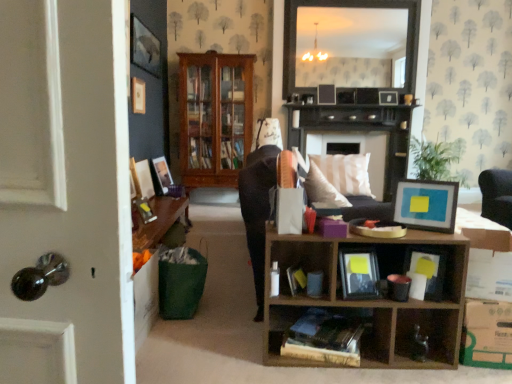
The width and height of the screenshot is (512, 384). I want to click on hardcover book at center, positioned as the first book in left-to-right order, so click(327, 330).

Where is `wooden cabinet at center`? The height and width of the screenshot is (384, 512). wooden cabinet at center is located at coordinates (215, 117).

At what (x,y) coordinates should I click in order to perform the action: click on matte black photo frame at center, the second book positioned from the left. Please return your answer as a coordinate pair (x, y). Looking at the image, I should click on point(359,273).

What do you see at coordinates (144, 179) in the screenshot? This screenshot has width=512, height=384. I see `wooden picture frame at left, placed as the 5th picture frame when sorted from back to front` at bounding box center [144, 179].

This screenshot has width=512, height=384. What are the coordinates of `hardcover book at center, placed as the third book when sorted from right to left` in the screenshot? It's located at (327, 330).

Consider the image. Between white cardboard box at lower right and matte black book at lower right, the first book in the right-to-left sequence, which one is positioned in front?

white cardboard box at lower right is closer to the camera.

Considering the positions of objects white cardboard box at lower right and matte black book at lower right, the third book when ordered from left to right, in the image provided, who is more to the right, white cardboard box at lower right or matte black book at lower right, the third book when ordered from left to right,?

white cardboard box at lower right is more to the right.

In terms of height, does white cardboard box at lower right look taller or shorter compared to matte black book at lower right, the third book when ordered from left to right?

white cardboard box at lower right is shorter than matte black book at lower right, the third book when ordered from left to right.

Is matte black picture frame at upper center, the 6th picture frame when ordered from left to right, situated inside matte black book at lower right, the first book in the right-to-left sequence, or outside?

The correct answer is: outside.

Which is less distant, (349,92) or (442,285)?

Point (349,92) is farther from the camera than point (442,285).

Measure the distance from matte black picture frame at upper center, marked as the sixth picture frame in a front-to-back arrangement, to matte black book at lower right, the first book in the right-to-left sequence.

The distance of matte black picture frame at upper center, marked as the sixth picture frame in a front-to-back arrangement, from matte black book at lower right, the first book in the right-to-left sequence, is 3.79 meters.

Is matte black picture frame at upper center, the second picture frame in the back-to-front sequence, further to the viewer compared to matte black book at lower right, the third book when ordered from left to right?

Yes, it is behind matte black book at lower right, the third book when ordered from left to right.

Does dark wood fireplace at center have a lesser width compared to matte black book at lower right, the first book in the right-to-left sequence?

No.

Does dark wood fireplace at center have a lesser height compared to matte black book at lower right, the first book in the right-to-left sequence?

Incorrect, the height of dark wood fireplace at center does not fall short of that of matte black book at lower right, the first book in the right-to-left sequence.

Is matte black book at lower right, the third book when ordered from left to right, inside dark wood fireplace at center?

That's incorrect, matte black book at lower right, the third book when ordered from left to right, is not inside dark wood fireplace at center.

Can you confirm if matte gold picture frame at upper left, arranged as the 7th picture frame when viewed from the right, is bigger than matte black picture frame at upper center, which is the third picture frame in right-to-left order?

Actually, matte gold picture frame at upper left, arranged as the 7th picture frame when viewed from the right, might be smaller than matte black picture frame at upper center, which is the third picture frame in right-to-left order.

Between matte gold picture frame at upper left, arranged as the 1th picture frame when viewed from the left, and matte black picture frame at upper center, acting as the 5th picture frame starting from the left, which one has more height?

With more height is matte black picture frame at upper center, acting as the 5th picture frame starting from the left.

Considering the points (136, 83) and (330, 97), which point is behind, point (136, 83) or point (330, 97)?

The point (330, 97) is more distant.

From a real-world perspective, does matte gold picture frame at upper left, the 6th picture frame viewed from the back, sit lower than matte black picture frame at upper center, marked as the 5th picture frame in a front-to-back arrangement?

Yes.

The width and height of the screenshot is (512, 384). What are the coordinates of `the 7th picture frame behind the white cardboard box at lower right` in the screenshot? It's located at (388, 98).

Considering the positions of point (390, 99) and point (504, 252), is point (390, 99) closer or farther from the camera than point (504, 252)?

Point (390, 99) appears to be farther away from the viewer than point (504, 252).

Could you tell me if matte black book at lower right, the first book in the right-to-left sequence, is turned towards wooden cube at lower right?

Yes.

Does matte black book at lower right, the first book in the right-to-left sequence, have a greater height compared to wooden cube at lower right?

No.

Where is `shelf on the left side of matte black book at lower right, the first book in the right-to-left sequence`? This screenshot has height=384, width=512. shelf on the left side of matte black book at lower right, the first book in the right-to-left sequence is located at coordinates (368, 300).

Is matte black book at lower right, the third book when ordered from left to right, wider or thinner than wooden cube at lower right?

matte black book at lower right, the third book when ordered from left to right, is thinner than wooden cube at lower right.

Who is smaller, matte black picture frame at upper center, the 6th picture frame when ordered from left to right, or wooden cabinet at center?

Smaller between the two is matte black picture frame at upper center, the 6th picture frame when ordered from left to right.

Does matte black picture frame at upper center, marked as the sixth picture frame in a front-to-back arrangement, turn towards wooden cabinet at center?

No, matte black picture frame at upper center, marked as the sixth picture frame in a front-to-back arrangement, is not oriented towards wooden cabinet at center.

Which is in front, point (339, 98) or point (234, 156)?

The point (339, 98) is closer to the camera.

I want to click on cardboard box lying in front of the matte black book at lower right, the third book when ordered from left to right, so click(x=486, y=256).

Which picture frame is the 6th one when counting from the back of the matte black book at lower right, the third book when ordered from left to right? Please provide its 2D coordinates.

[(346, 95)]

When comparing their distances from matte wooden picture frame at left, positioned as the fourth picture frame in back-to-front order, does matte black mirror at upper center or hardcover book at center, placed as the third book when sorted from right to left, seem closer?

matte black mirror at upper center is positioned closer to the anchor matte wooden picture frame at left, positioned as the fourth picture frame in back-to-front order.

Considering their positions, is hardcover book at center, placed as the third book when sorted from right to left, positioned closer to wooden cube at lower right than matte black picture frame at upper center, which appears as the 7th picture frame when viewed from the left?

hardcover book at center, placed as the third book when sorted from right to left, is closer to wooden cube at lower right.

Based on the photo, considering their positions, is blue matte picture frame at center, the first picture frame viewed from the front, positioned further to wooden cabinet at center than matte black book at lower right, the first book in the right-to-left sequence?

The object further to wooden cabinet at center is matte black book at lower right, the first book in the right-to-left sequence.

Which object lies nearer to the anchor point matte black picture frame at upper center, acting as the 5th picture frame starting from the left, matte black picture frame at upper center, arranged as the second picture frame when viewed from the right, or hardcover book at center, positioned as the first book in left-to-right order?

matte black picture frame at upper center, arranged as the second picture frame when viewed from the right, is closer to matte black picture frame at upper center, acting as the 5th picture frame starting from the left.

Considering their positions, is wooden cube at lower right positioned closer to blue matte picture frame at center, the first picture frame viewed from the front, than matte gold picture frame at upper left, the second picture frame positioned from the front?

Based on the image, wooden cube at lower right appears to be nearer to blue matte picture frame at center, the first picture frame viewed from the front.

Based on their spatial positions, is matte black photo frame at center, acting as the second book starting from the right, or matte gold picture frame at upper left, arranged as the 7th picture frame when viewed from the right, further from matte black mirror at upper center?

The object further to matte black mirror at upper center is matte black photo frame at center, acting as the second book starting from the right.

Based on their spatial positions, is blue matte picture frame at center, which appears as the fourth picture frame when viewed from the left, or matte black photo frame at center, acting as the second book starting from the right, further from matte black picture frame at upper center, which is the third picture frame in right-to-left order?

matte black photo frame at center, acting as the second book starting from the right.

Estimate the real-world distances between objects in this image. Which object is further from matte wooden picture frame at left, which is the fourth picture frame in front-to-back order, matte black book at lower right, the third book when ordered from left to right, or wooden cube at lower right?

The object further to matte wooden picture frame at left, which is the fourth picture frame in front-to-back order, is matte black book at lower right, the third book when ordered from left to right.

At what (x,y) coordinates should I click in order to perform the action: click on cabinetry between white cardboard box at lower right and matte black mirror at upper center along the z-axis. Please return your answer as a coordinate pair (x, y). The height and width of the screenshot is (384, 512). Looking at the image, I should click on (215, 117).

Where is `cabinetry positioned between hardcover book at center, positioned as the first book in left-to-right order, and matte black picture frame at upper center, which appears as the 7th picture frame when viewed from the left, from near to far`? cabinetry positioned between hardcover book at center, positioned as the first book in left-to-right order, and matte black picture frame at upper center, which appears as the 7th picture frame when viewed from the left, from near to far is located at coordinates (215, 117).

Where is `cabinetry between matte black photo frame at center, acting as the second book starting from the right, and matte black picture frame at upper center, acting as the 5th picture frame starting from the left, along the z-axis`? The image size is (512, 384). cabinetry between matte black photo frame at center, acting as the second book starting from the right, and matte black picture frame at upper center, acting as the 5th picture frame starting from the left, along the z-axis is located at coordinates (215, 117).

Locate an element on the screen. This screenshot has height=384, width=512. cabinetry between matte gold picture frame at upper left, arranged as the 1th picture frame when viewed from the left, and matte black picture frame at upper center, acting as the 5th picture frame starting from the left, from left to right is located at coordinates (215, 117).